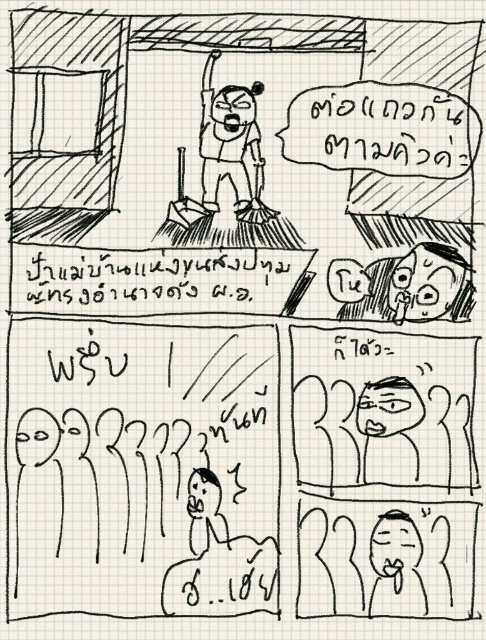
Who is shorter, black paper at center or shiny black face at upper right?

black paper at center

Which is below, black paper at center or shiny black face at upper right?

shiny black face at upper right

Which is behind, point (295, 269) or point (464, 289)?

The point (464, 289) is behind.

This screenshot has height=640, width=486. I want to click on black paper at center, so click(155, 278).

Does black paper at center appear on the right side of angry face broom at upper center?

Incorrect, black paper at center is not on the right side of angry face broom at upper center.

Which is behind, point (175, 298) or point (252, 145)?

The point (175, 298) is more distant.

I want to click on black paper at center, so click(155, 278).

Locate an element on the screen. angry face broom at upper center is located at coordinates (227, 177).

What do you see at coordinates (227, 177) in the screenshot? The width and height of the screenshot is (486, 640). I see `angry face broom at upper center` at bounding box center [227, 177].

Which is behind, point (260, 86) or point (447, 266)?

Positioned behind is point (447, 266).

This screenshot has height=640, width=486. Identify the location of angry face broom at upper center. (227, 177).